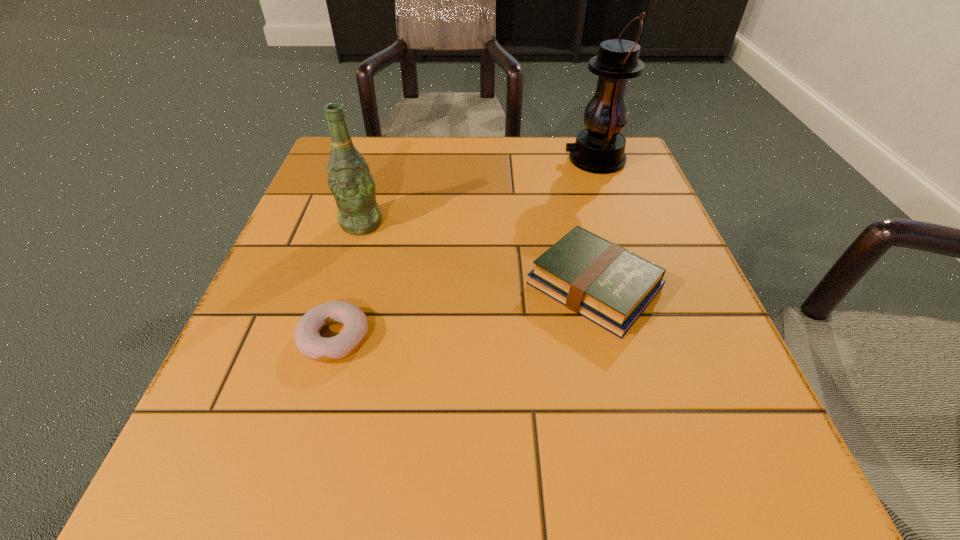
You are a GUI agent. You are given a task and a screenshot of the screen. Output one action in this format:
    pyautogui.click(x=<x>, y=<y>)
    Task: Click on the vacant position in the image that satisfies the following two spatial constraints: 1. on the surface of the book; 2. on the right side of the third nearest object
    
    Given the screenshot: What is the action you would take?
    pyautogui.click(x=343, y=286)

This screenshot has width=960, height=540. In order to click on free location that satisfies the following two spatial constraints: 1. above the farthest object, indicating its light source; 2. on the front side of the doughnut in this screenshot , I will do `click(658, 338)`.